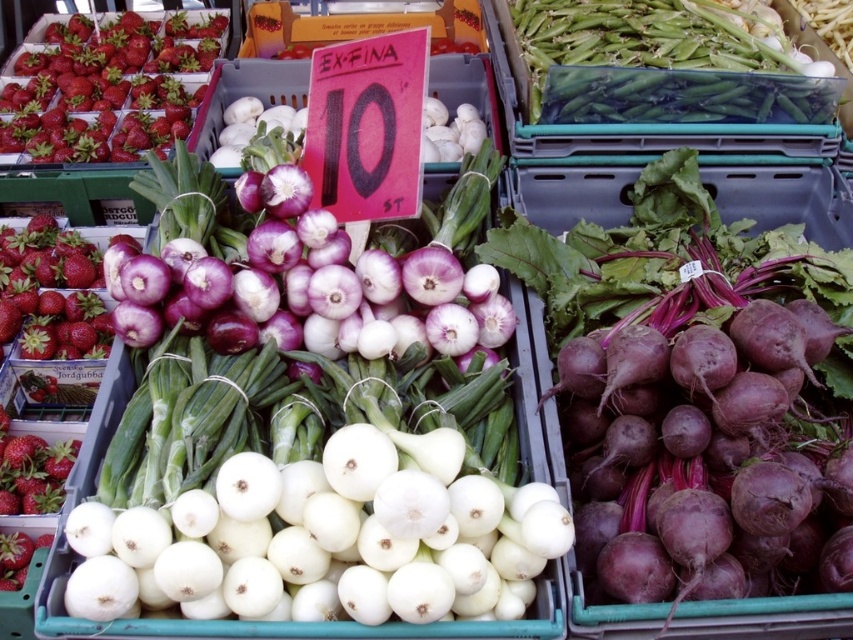
Which is below, green smooth skin at upper center or shiny red strawberries at upper left?

green smooth skin at upper center is lower down.

Image resolution: width=853 pixels, height=640 pixels. Find the location of `green smooth skin at upper center`. green smooth skin at upper center is located at coordinates (657, 65).

The width and height of the screenshot is (853, 640). In order to click on purple matte beetroot at right in this screenshot , I will do `click(663, 403)`.

Who is more distant from viewer, (656,349) or (79,19)?

The point (79,19) is more distant.

The image size is (853, 640). Identify the location of purple matte beetroot at right. (663, 403).

Who is more distant from viewer, (x=816, y=195) or (x=740, y=104)?

Positioned behind is point (x=816, y=195).

From the picture: Is the position of purple matte beetroot at right less distant than that of green smooth skin at upper center?

Yes, purple matte beetroot at right is closer to the viewer.

This screenshot has height=640, width=853. Describe the element at coordinates (663, 403) in the screenshot. I see `purple matte beetroot at right` at that location.

Where is `purple matte beetroot at right`? purple matte beetroot at right is located at coordinates (663, 403).